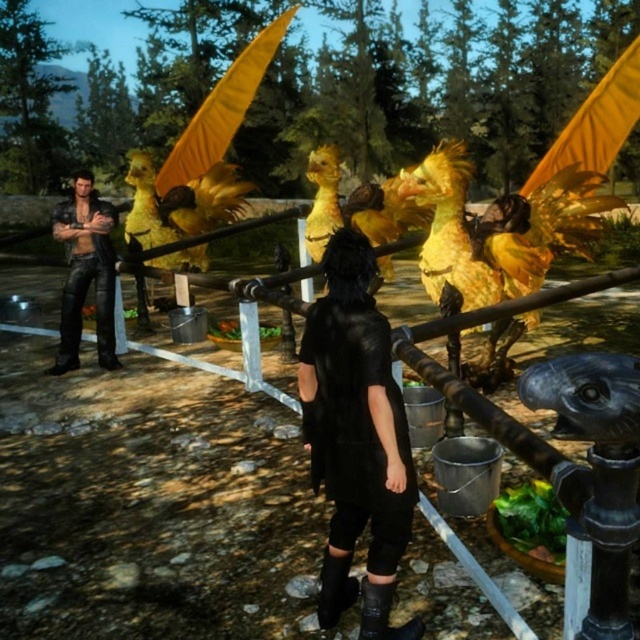
Is point (381, 504) less distant than point (93, 221)?

Yes.

Can you confirm if black matte dress at center is taller than leather jacket at left?

In fact, black matte dress at center may be shorter than leather jacket at left.

Is point (396, 502) positioned before point (93, 257)?

That is True.

Find the location of a particular element. black matte dress at center is located at coordinates (356, 438).